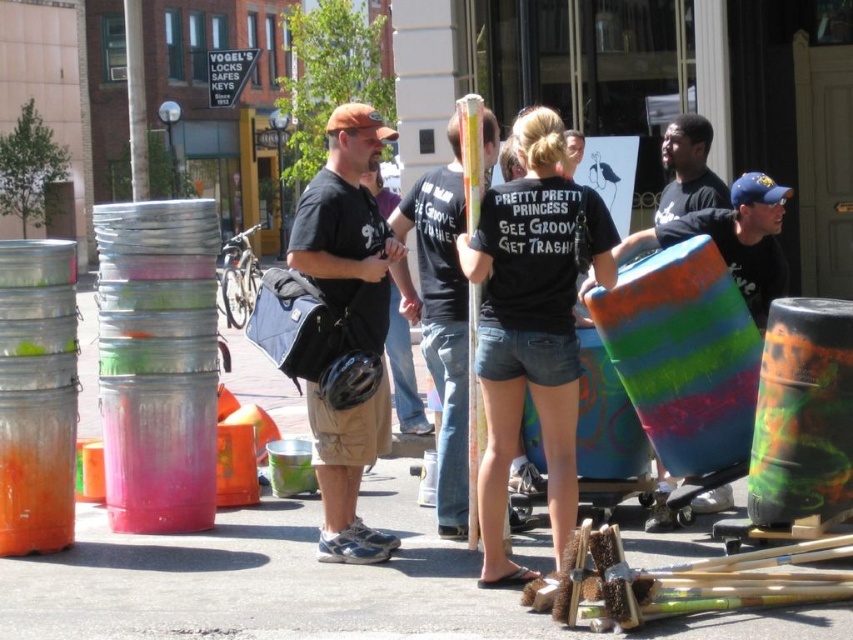
You are a photographer trying to capture the entire scene of the multicolored painted drum at center and the black cotton shirt at center in one shot. Considering their sizes, which object should you focus on to ensure both are clearly visible in the frame?

The multicolored painted drum at center is larger than the black cotton shirt at center, so focusing on the drum will help ensure both objects are clearly visible in the frame.